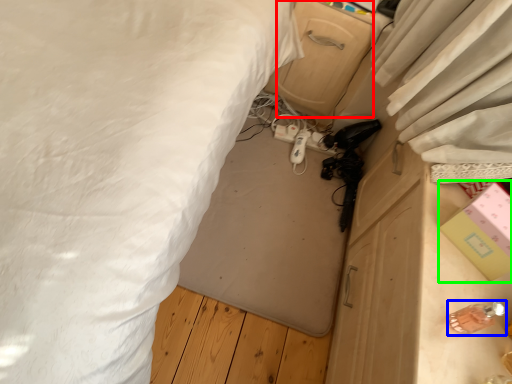
Question: Which is nearer to the drawer (highlighted by a red box)? equipment (highlighted by a blue box) or box (highlighted by a green box).

Choices:
 (A) equipment
 (B) box

Answer: (B)